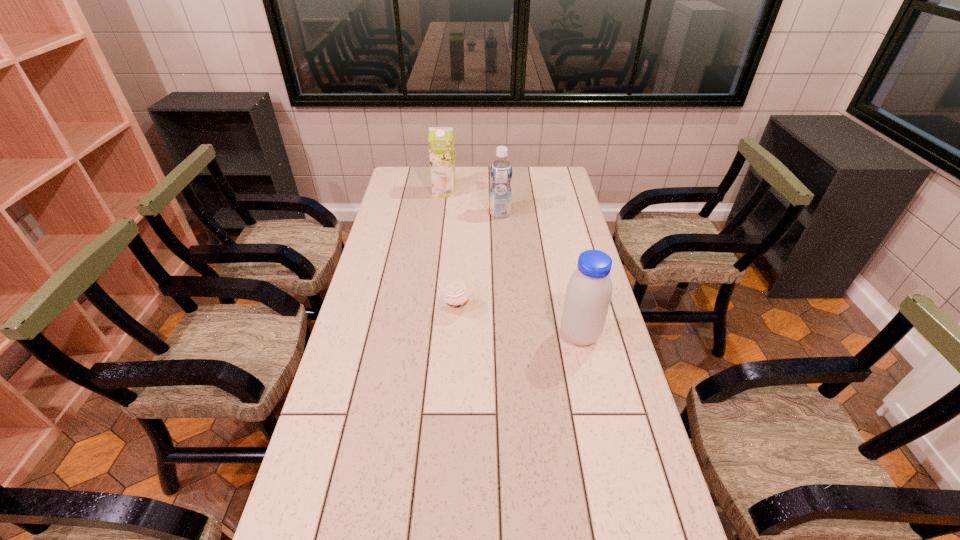
Point out which object is positioned as the nearest to the third object from left to right. Please provide its 2D coordinates. Your answer should be formatted as a tuple, i.e. [(x, y)], where the tuple contains the x and y coordinates of a point satisfying the conditions above.

[(441, 139)]

Where is `soya milk that can be found as the closest to the muffin`? Image resolution: width=960 pixels, height=540 pixels. soya milk that can be found as the closest to the muffin is located at coordinates pos(588,295).

You are a GUI agent. You are given a task and a screenshot of the screen. Output one action in this format:
    pyautogui.click(x=<x>, y=<y>)
    Task: Click on the soya milk identified as the closest to the farthest soya milk
    Image resolution: width=960 pixels, height=540 pixels.
    Given the screenshot: What is the action you would take?
    pyautogui.click(x=500, y=171)

Find the location of a particular element. The width and height of the screenshot is (960, 540). free location that satisfies the following two spatial constraints: 1. on the label of the nearest soya milk; 2. on the left side of the second soya milk from right to left is located at coordinates (508, 335).

Identify the location of vacant point that satisfies the following two spatial constraints: 1. on the label of the second farthest soya milk; 2. on the left side of the nearest soya milk. The image size is (960, 540). (508, 335).

Locate an element on the screen. The width and height of the screenshot is (960, 540). free location that satisfies the following two spatial constraints: 1. on the front side of the rightmost object; 2. on the right side of the third farthest object is located at coordinates (456, 335).